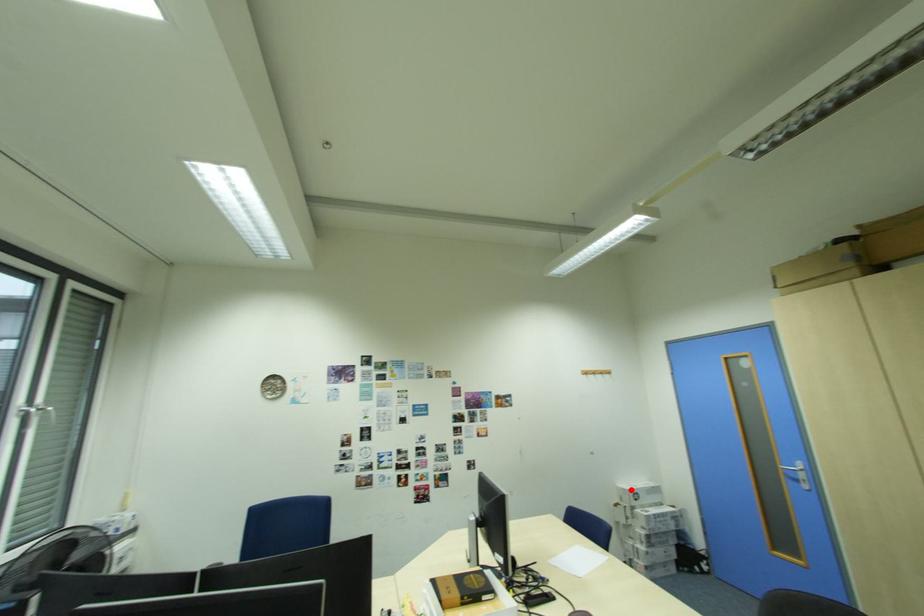
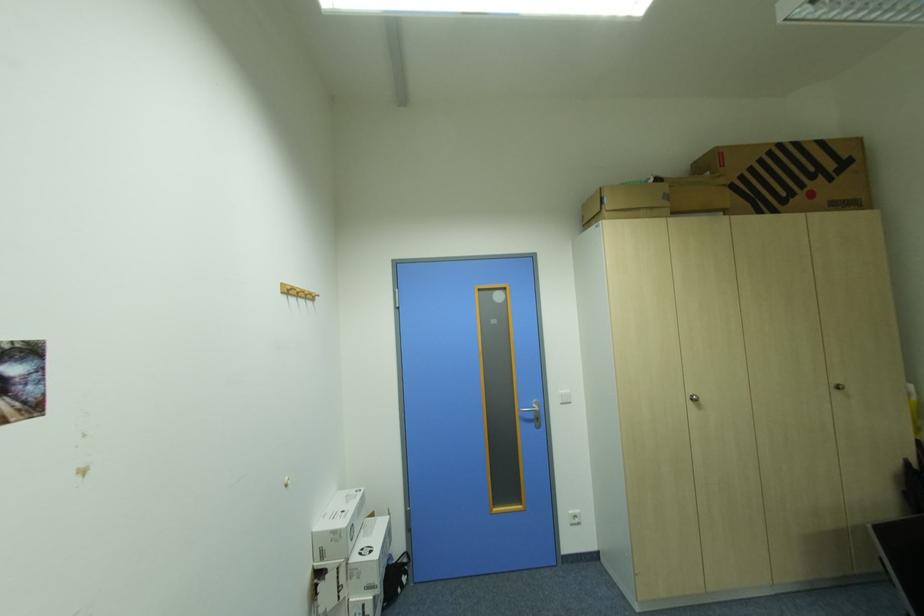
Find the pixel in the second image that matches the highlighted location in the first image.

(341, 533)